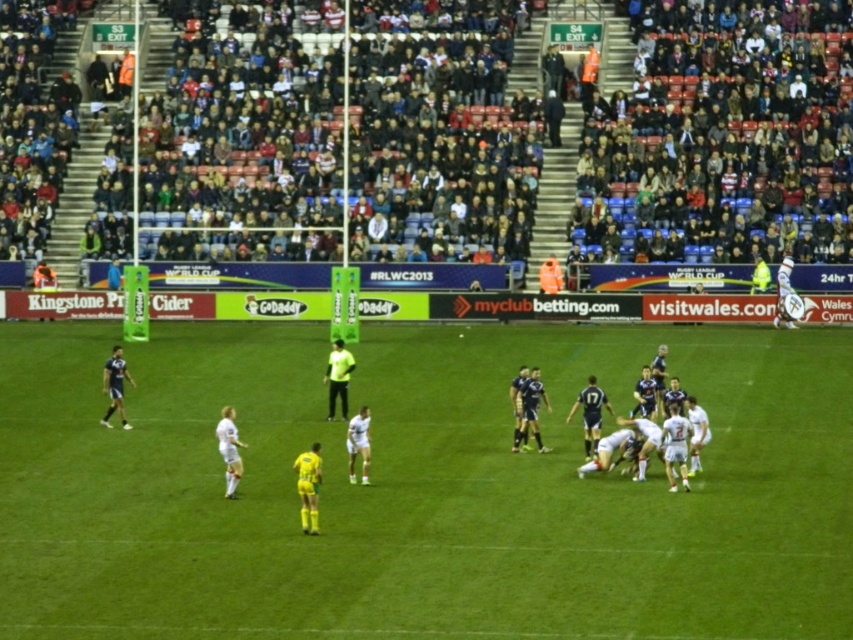
Question: Which point is farther to the camera?

Choices:
 (A) green grass field at center
 (B) white jersey at center

Answer: (B)

Question: Which of the following is the farthest from the observer?

Choices:
 (A) (670, 417)
 (B) (302, 483)
 (C) (352, 474)
 (D) (590, 435)

Answer: (D)

Question: Which of the following is the farthest from the observer?

Choices:
 (A) white jersey at center
 (B) white jersey at lower left
 (C) blue jersey at center

Answer: (C)

Question: Can you confirm if green grass field at center is positioned below dark blue jersey at center?

Choices:
 (A) yes
 (B) no

Answer: (A)

Question: Considering the relative positions of white jersey at center and white matte jersey at center in the image provided, where is white jersey at center located with respect to white matte jersey at center?

Choices:
 (A) above
 (B) below

Answer: (A)

Question: Observing the image, what is the correct spatial positioning of yellow jersey at center in reference to dark blue jersey at center?

Choices:
 (A) above
 (B) below

Answer: (B)